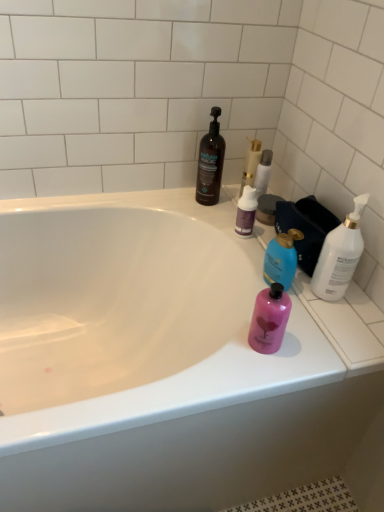
You are a GUI agent. You are given a task and a screenshot of the screen. Output one action in this format:
    pyautogui.click(x=<x>, y=<y>)
    Task: Click on the vacant space behind purple matte bottle at upper center, the fourth bottle in the right-to-left sequence
    The height and width of the screenshot is (512, 384).
    Given the screenshot: What is the action you would take?
    pyautogui.click(x=229, y=206)